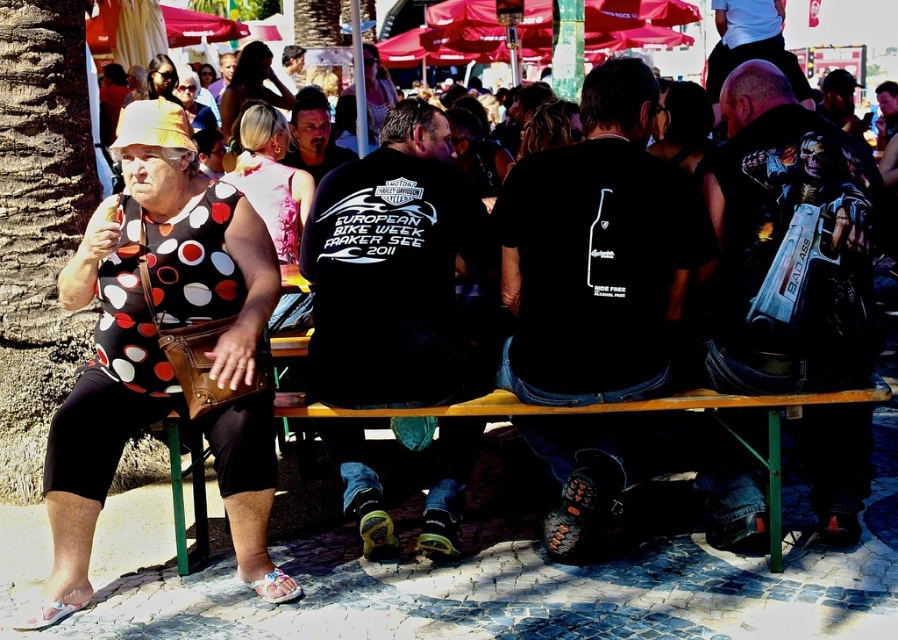
Measure the distance between polka dot fabric dress at left and camera.

The distance of polka dot fabric dress at left from camera is 7.65 meters.

Between polka dot fabric dress at left and polka dot fabric dress at upper left, which one is positioned higher?

polka dot fabric dress at upper left

Is point (121, 196) more distant than point (306, 193)?

No.

At what (x,y) coordinates should I click in order to perform the action: click on polka dot fabric dress at left. Please return your answer as a coordinate pair (x, y). Looking at the image, I should click on (146, 323).

Is point (179, 253) closer to viewer compared to point (262, 48)?

Yes, point (179, 253) is closer to viewer.

Locate an element on the screen. polka dot fabric dress at left is located at coordinates (146, 323).

Describe the element at coordinates (271, 177) in the screenshot. I see `polka dot fabric dress at upper left` at that location.

Does polka dot fabric dress at upper left appear on the left side of blonde hair at upper center?

No, polka dot fabric dress at upper left is not to the left of blonde hair at upper center.

Between point (274, 141) and point (282, 84), which one is positioned in front?

Point (274, 141)

The height and width of the screenshot is (640, 898). I want to click on polka dot fabric dress at upper left, so click(x=271, y=177).